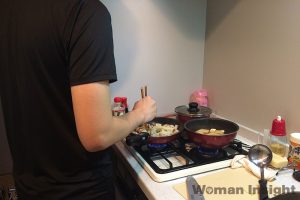
Locate an element on the screen. Image resolution: width=300 pixels, height=200 pixels. gas stove is located at coordinates (198, 154), (157, 149).